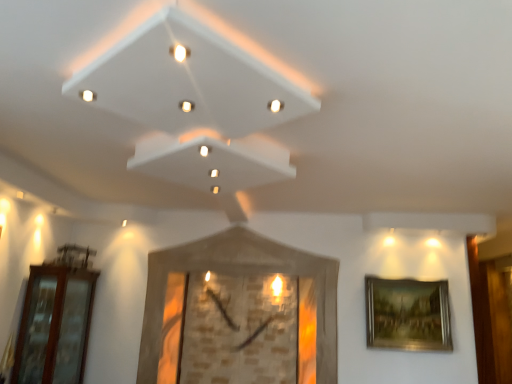
Question: Is gold metallic picture frame at right, placed as the 2th picture frame when sorted from left to right, taller or shorter than wooden clock at center, the 2th picture frame positioned from the right?

Choices:
 (A) tall
 (B) short

Answer: (B)

Question: Is gold metallic picture frame at right, placed as the 2th picture frame when sorted from left to right, to the left or to the right of wooden clock at center, the 2th picture frame positioned from the right, in the image?

Choices:
 (A) right
 (B) left

Answer: (A)

Question: Which object is positioned farthest from the brown glass door at left?

Choices:
 (A) gold metallic picture frame at right, placed as the 2th picture frame when sorted from left to right
 (B) wooden clock at center, the first picture frame in the left-to-right sequence

Answer: (A)

Question: Based on their relative distances, which object is farther from the wooden clock at center, the 2th picture frame positioned from the right?

Choices:
 (A) gold metallic picture frame at right, the first picture frame viewed from the right
 (B) brown glass door at left

Answer: (B)